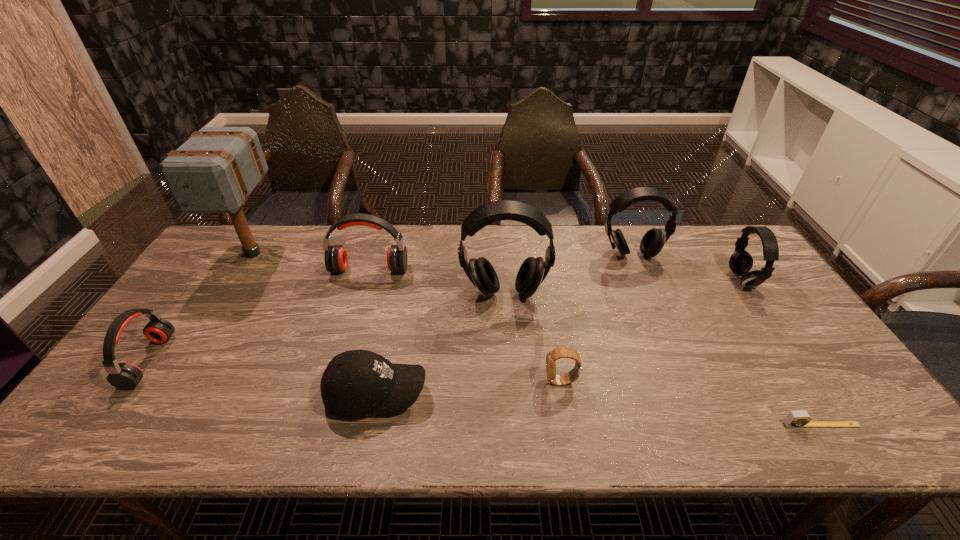
In order to click on gray mallet in this screenshot , I will do `click(215, 171)`.

The height and width of the screenshot is (540, 960). Find the location of `mallet`. mallet is located at coordinates (215, 171).

Find the location of a particular element. This screenshot has height=540, width=960. the third earphone from left to right is located at coordinates (533, 271).

The width and height of the screenshot is (960, 540). I want to click on the tallest earphone, so click(x=533, y=271).

Locate an element on the screen. The height and width of the screenshot is (540, 960). the second smallest black earphone is located at coordinates (653, 241).

Locate an element on the screen. the third tallest object is located at coordinates (653, 241).

Identify the location of the bigger red earphone. (336, 259).

Find the location of a particular element. This screenshot has height=540, width=960. the farther red earphone is located at coordinates (336, 259).

The image size is (960, 540). In order to click on the rightmost earphone in this screenshot , I will do `click(740, 262)`.

I want to click on the smallest black earphone, so click(740, 262).